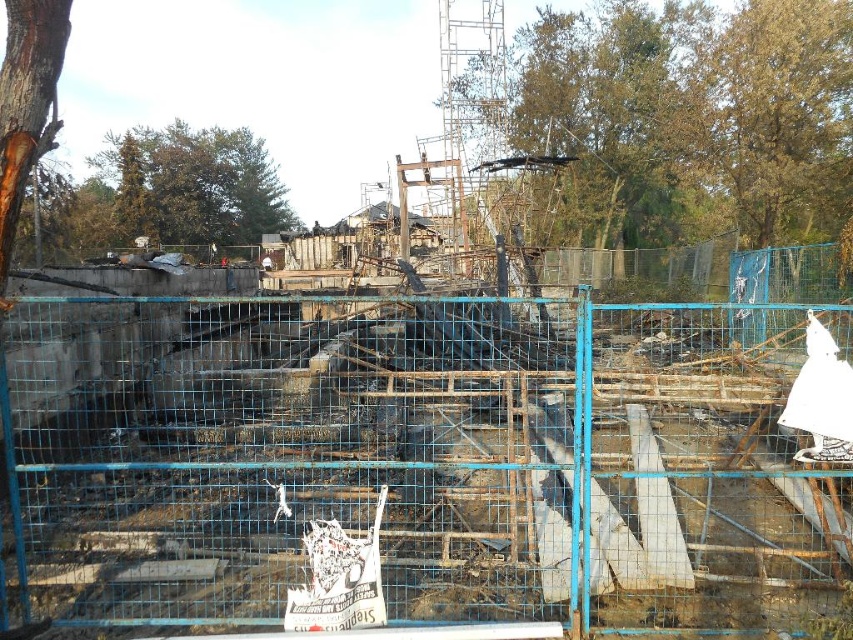
You are a drone operator tasked with assessing the damage in the area. Your drone is currently hovering above the blue metal fence in the foreground. To get a clear view of the green leafy tree at upper center, which direction should you move the drone? Please provide your answer in terms of cardinal directions like north, south, east, or west.

The green leafy tree at upper center is located at point coordinates of (685, 122). Since the drone is above the blue metal fence in the foreground, moving it north would bring it closer to the tree.

You are a firefighter assessing the damage after a fire. You need to determine if you can safely walk from the green leafy tree at upper left to the brown rough bark at left without crossing the blue metal fence. Can you do this?

The distance between the green leafy tree at upper left and the brown rough bark at left is 50.59 meters. Since the blue metal fence is in the foreground and the two objects are beyond it, you can safely walk between them without crossing the fence.

You are a firefighter assessing the scene. You see a green leafy tree at upper center in the distance. If your ladder can reach up to 12 meters, can you reach the tree with your ladder?

The green leafy tree at upper center is 11.66 meters away from the camera, so yes, the ladder can reach it since its maximum reach is 12 meters.